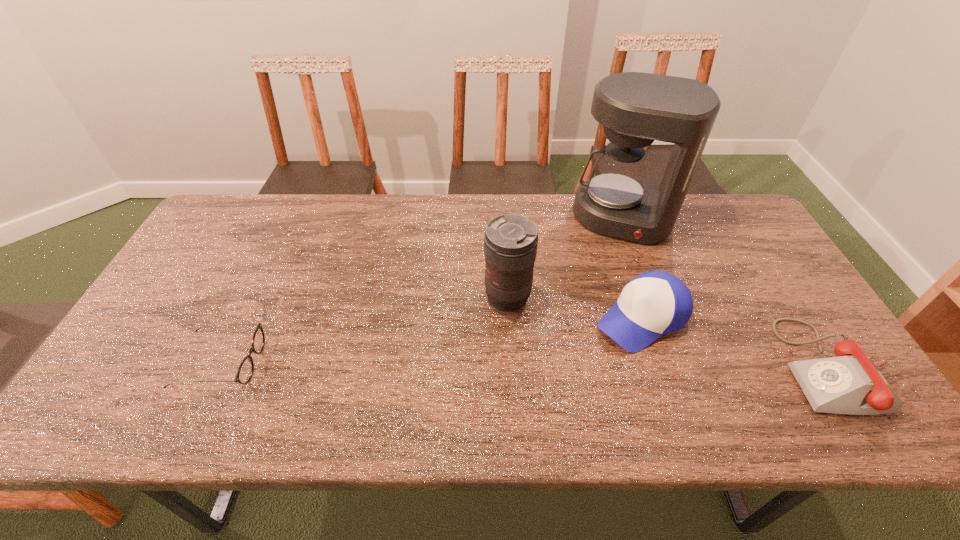
Locate an element on the screen. The image size is (960, 540). free location at the near edge of the desktop is located at coordinates (431, 377).

In the image, there is a desktop. Identify the location of vacant space at the left edge. The width and height of the screenshot is (960, 540). (189, 335).

Where is `free space at the right edge`? Image resolution: width=960 pixels, height=540 pixels. free space at the right edge is located at coordinates (816, 323).

Locate an element on the screen. The width and height of the screenshot is (960, 540). vacant space at the far left corner of the desktop is located at coordinates (270, 198).

You are a GUI agent. You are given a task and a screenshot of the screen. Output one action in this format:
    pyautogui.click(x=<x>, y=<y>)
    Task: Click on the empty space that is in between the rightmost object and the spectacles
    This screenshot has height=540, width=960.
    Given the screenshot: What is the action you would take?
    pyautogui.click(x=528, y=364)

You are a GUI agent. You are given a task and a screenshot of the screen. Output one action in this format:
    pyautogui.click(x=<x>, y=<y>)
    Task: Click on the free space between the tallest object and the telephoto lens
    The image size is (960, 540).
    Given the screenshot: What is the action you would take?
    pyautogui.click(x=564, y=258)

At what (x,y) coordinates should I click in order to perform the action: click on blank region between the coffee maker and the fourth tallest object. Please return your answer as a coordinate pair (x, y). This screenshot has width=960, height=540. Looking at the image, I should click on (729, 293).

Where is `free point between the second shortest object and the spectacles`? The width and height of the screenshot is (960, 540). free point between the second shortest object and the spectacles is located at coordinates (528, 364).

Identify the location of vacant region between the tallest object and the leftmost object. Image resolution: width=960 pixels, height=540 pixels. (421, 291).

The image size is (960, 540). In order to click on vacant area between the coffee maker and the leftmost object in this screenshot , I will do `click(421, 291)`.